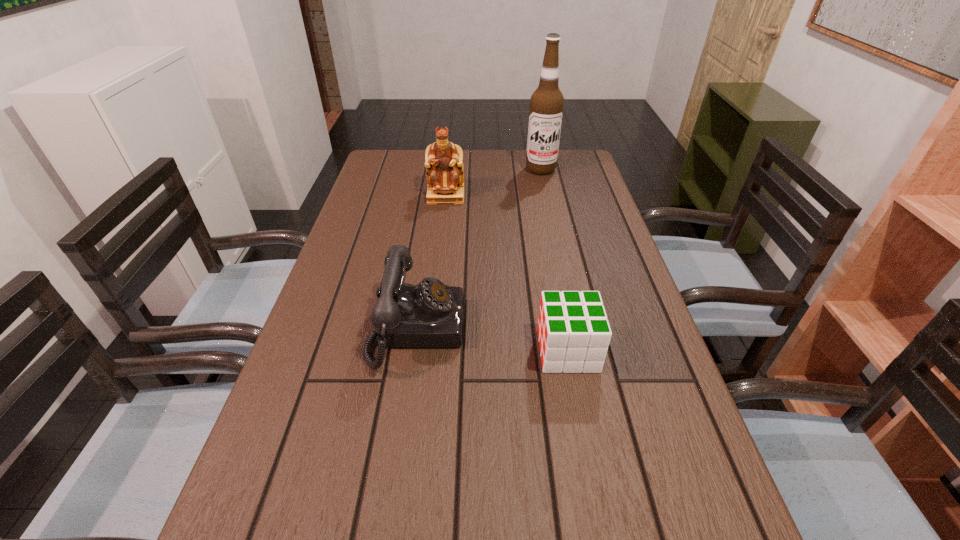
The width and height of the screenshot is (960, 540). Identify the location of free region at the far right corner of the desktop. (570, 172).

I want to click on empty location between the farthest object and the cube, so click(x=554, y=260).

In order to click on unoccupied position between the third nearest object and the tallest object in this screenshot , I will do `click(493, 183)`.

The image size is (960, 540). I want to click on empty space between the third nearest object and the second shortest object, so click(431, 262).

At what (x,y) coordinates should I click in order to perform the action: click on vacant space that is in between the farthest object and the figurine. Please return your answer as a coordinate pair (x, y). Looking at the image, I should click on (493, 183).

The width and height of the screenshot is (960, 540). Find the location of `vacant region between the shortest object and the third tallest object`. vacant region between the shortest object and the third tallest object is located at coordinates (492, 340).

Locate which object is the second closest to the telephone. Please provide its 2D coordinates. Your answer should be formatted as a tuple, i.e. [(x, y)], where the tuple contains the x and y coordinates of a point satisfying the conditions above.

[(443, 160)]

This screenshot has height=540, width=960. Identify the location of the third closest object to the tallest object. (573, 331).

The height and width of the screenshot is (540, 960). Identify the location of vacant position in the image that satisfies the following two spatial constraints: 1. on the label of the farthest object; 2. on the red face of the cube. (580, 350).

I want to click on vacant space that satisfies the following two spatial constraints: 1. on the label of the farthest object; 2. on the red face of the cube, so click(580, 350).